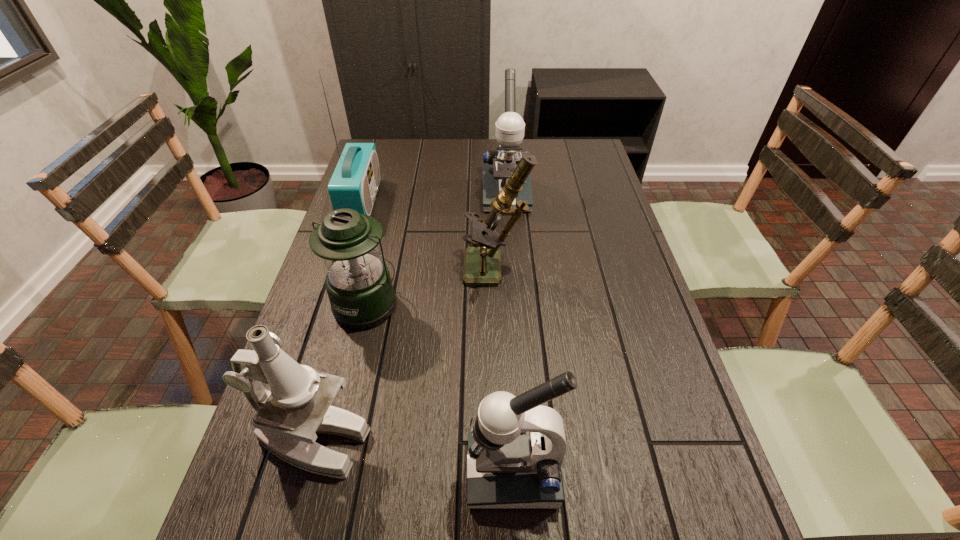
At what (x,y) coordinates should I click in order to perform the action: click on vacant area in the image that satisfies the following two spatial constraints: 1. on the back side of the shortest object; 2. on the left side of the leftmost microscope. Please return your answer as a coordinate pair (x, y). Looking at the image, I should click on (351, 303).

At what (x,y) coordinates should I click in order to perform the action: click on free space that satisfies the following two spatial constraints: 1. on the front panel of the radio receiver; 2. on the right side of the leftmost microscope. Please return your answer as a coordinate pair (x, y). Looking at the image, I should click on (284, 441).